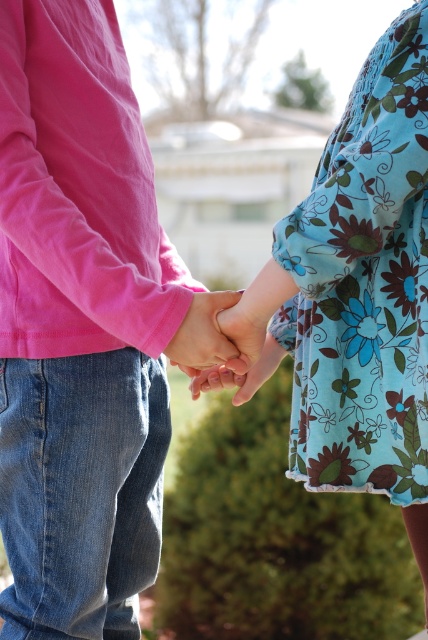
Question: Does floral fabric dress at center have a greater width compared to matte pink hand at center?

Choices:
 (A) yes
 (B) no

Answer: (A)

Question: Which object is closer to the camera taking this photo?

Choices:
 (A) floral fabric dress at center
 (B) matte pink hand at center

Answer: (A)

Question: Among these objects, which one is farthest from the camera?

Choices:
 (A) floral fabric dress at center
 (B) matte pink hand at center

Answer: (B)

Question: Where is floral fabric dress at center located in relation to matte pink hand at center in the image?

Choices:
 (A) below
 (B) above

Answer: (B)

Question: Which point is farther to the camera?

Choices:
 (A) matte pink hand at center
 (B) floral fabric dress at center

Answer: (A)

Question: Is floral fabric dress at center positioned before matte pink hand at center?

Choices:
 (A) yes
 (B) no

Answer: (A)